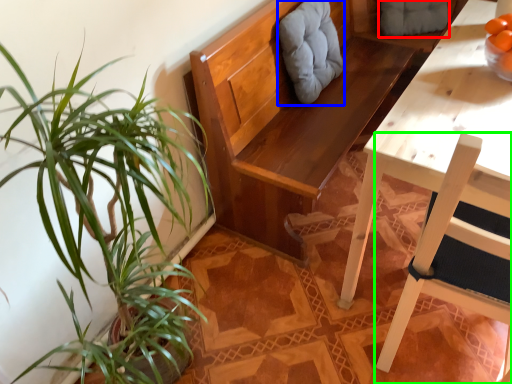
Question: Which object is positioned closest to swivel chair (highlighted by a red box)? Select from swivel chair (highlighted by a blue box) and chair (highlighted by a green box).

Choices:
 (A) swivel chair
 (B) chair

Answer: (A)